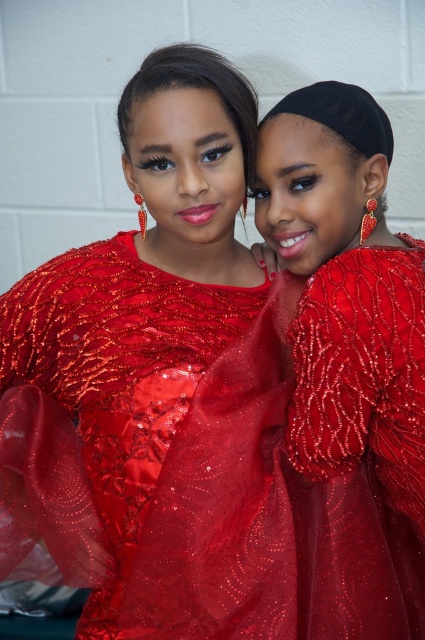
Which is more to the left, shiny sequined dress at center or beaded silk dress at center?

Positioned to the left is shiny sequined dress at center.

Does shiny sequined dress at center appear on the left side of beaded silk dress at center?

Yes, shiny sequined dress at center is to the left of beaded silk dress at center.

Does point (215, 140) lie in front of point (424, 490)?

No, it is not.

This screenshot has width=425, height=640. I want to click on shiny sequined dress at center, so click(x=155, y=387).